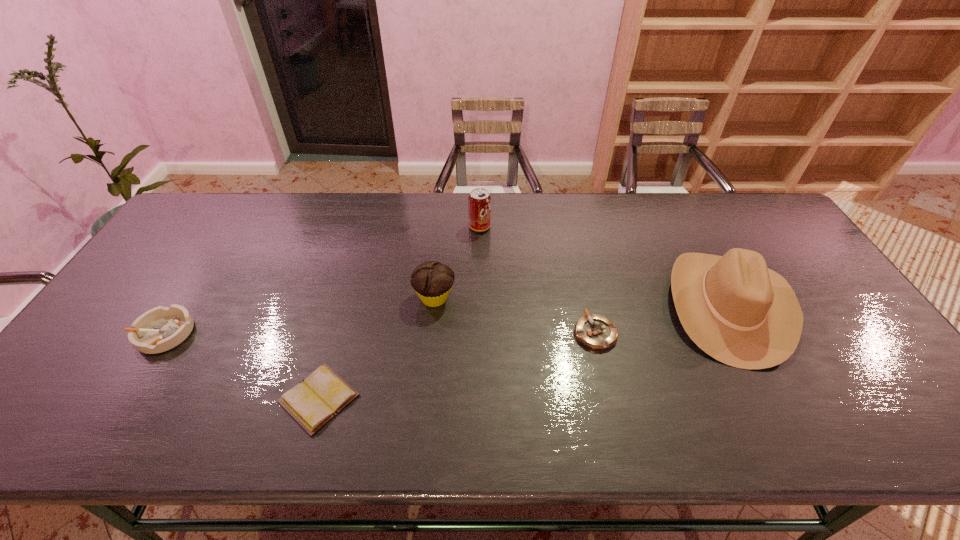
This screenshot has height=540, width=960. Find the location of `free location that satisfies the following two spatial constraints: 1. on the front side of the third tallest object; 2. on the left side of the shorter ashtray`. free location that satisfies the following two spatial constraints: 1. on the front side of the third tallest object; 2. on the left side of the shorter ashtray is located at coordinates (431, 333).